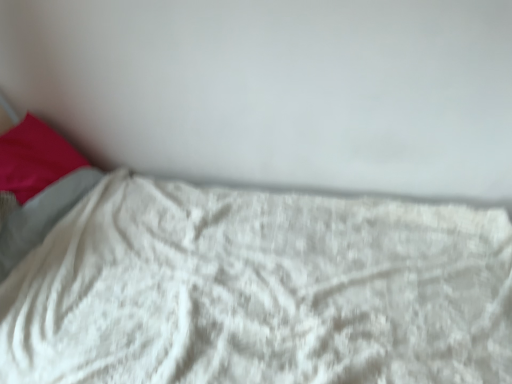
I want to click on matte pink pillow at left, so (x=34, y=158).

Describe the element at coordinates (34, 158) in the screenshot. I see `matte pink pillow at left` at that location.

What are the coordinates of `white fluffy blanket at lower center` in the screenshot? It's located at (259, 290).

The image size is (512, 384). What do you see at coordinates (259, 290) in the screenshot?
I see `white fluffy blanket at lower center` at bounding box center [259, 290].

This screenshot has width=512, height=384. I want to click on matte pink pillow at left, so click(x=34, y=158).

Which object is positioned more to the left, matte pink pillow at left or white fluffy blanket at lower center?

matte pink pillow at left.

From the picture: Does matte pink pillow at left lie in front of white fluffy blanket at lower center?

No, it is behind white fluffy blanket at lower center.

Which is behind, point (15, 151) or point (381, 376)?

Positioned behind is point (15, 151).

From the image's perspective, would you say matte pink pillow at left is positioned over white fluffy blanket at lower center?

Yes.

From a real-world perspective, relative to white fluffy blanket at lower center, is matte pink pillow at left vertically above or below?

From a real-world perspective, matte pink pillow at left is physically above white fluffy blanket at lower center.

Is matte pink pillow at left wider than white fluffy blanket at lower center?

No, matte pink pillow at left is not wider than white fluffy blanket at lower center.

Can you confirm if matte pink pillow at left is shorter than white fluffy blanket at lower center?

Yes.

Is matte pink pillow at left bigger or smaller than white fluffy blanket at lower center?

In the image, matte pink pillow at left appears to be smaller than white fluffy blanket at lower center.

Which is correct: matte pink pillow at left is inside white fluffy blanket at lower center, or outside of it?

matte pink pillow at left is inside white fluffy blanket at lower center.

Does matte pink pillow at left touch white fluffy blanket at lower center?

No, matte pink pillow at left is not beside white fluffy blanket at lower center.

Based on the photo, is matte pink pillow at left turned away from white fluffy blanket at lower center?

Yes.

Where is `bed directly beneath the matte pink pillow at left (from a real-world perspective)`? bed directly beneath the matte pink pillow at left (from a real-world perspective) is located at coordinates (259, 290).

Considering the positions of objects white fluffy blanket at lower center and matte pink pillow at left in the image provided, who is more to the left, white fluffy blanket at lower center or matte pink pillow at left?

From the viewer's perspective, matte pink pillow at left appears more on the left side.

Which object is more forward, white fluffy blanket at lower center or matte pink pillow at left?

white fluffy blanket at lower center is more forward.

Does point (92, 367) lie in front of point (71, 164)?

Yes, it is.

From the image's perspective, is white fluffy blanket at lower center above matte pink pillow at left?

No, from the image's perspective, white fluffy blanket at lower center is not over matte pink pillow at left.

From a real-world perspective, which object stands above the other?

In real-world perspective, matte pink pillow at left is above.

Can you confirm if white fluffy blanket at lower center is thinner than matte pink pillow at left?

No.

Can you confirm if white fluffy blanket at lower center is shorter than matte pink pillow at left?

Incorrect, the height of white fluffy blanket at lower center does not fall short of that of matte pink pillow at left.

Based on their sizes in the image, would you say white fluffy blanket at lower center is bigger or smaller than matte pink pillow at left?

In the image, white fluffy blanket at lower center appears to be larger than matte pink pillow at left.

Is matte pink pillow at left a part of white fluffy blanket at lower center?

Yes, white fluffy blanket at lower center contains matte pink pillow at left.

Is white fluffy blanket at lower center next to matte pink pillow at left and touching it?

white fluffy blanket at lower center is not next to matte pink pillow at left, and they're not touching.

Is white fluffy blanket at lower center aimed at matte pink pillow at left?

No, white fluffy blanket at lower center is not aimed at matte pink pillow at left.

Locate an element on the screen. Image resolution: width=512 pixels, height=384 pixels. pillow positioned vertically above the white fluffy blanket at lower center (from a real-world perspective) is located at coordinates (34, 158).

The width and height of the screenshot is (512, 384). There is a white fluffy blanket at lower center. In order to click on pillow above it (from a real-world perspective) in this screenshot , I will do `click(34, 158)`.

I want to click on bed that appears below the matte pink pillow at left (from a real-world perspective), so click(x=259, y=290).